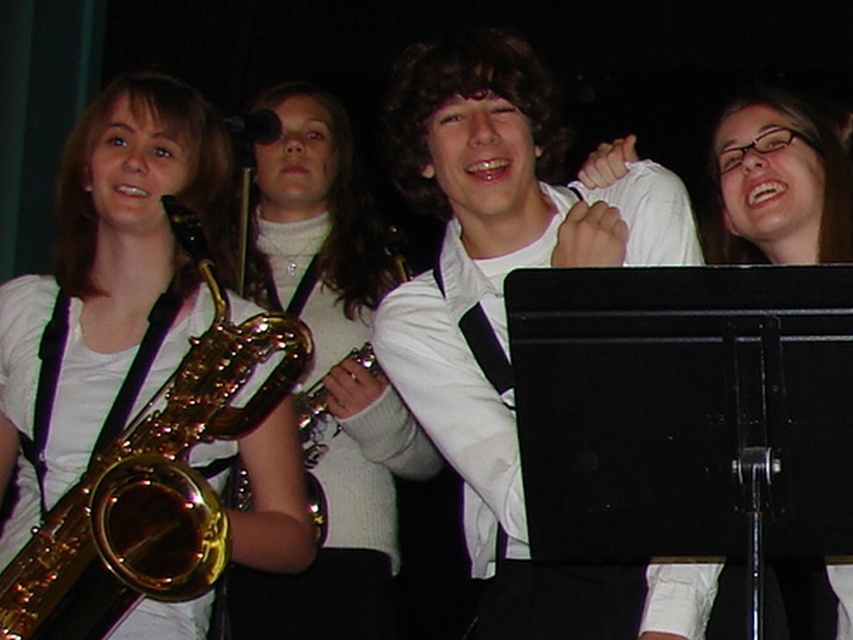
You are a photographer in the audience taking pictures of the stage. You notice the white matte shirt at center and the gold shiny saxophone at left. Which object is positioned higher in the image?

The white matte shirt at center is above the gold shiny saxophone at left, so it is positioned higher in the image.

In the concert scene, where is the white matte shirt at center located in terms of coordinates?

The white matte shirt at center is located at point (502, 301).